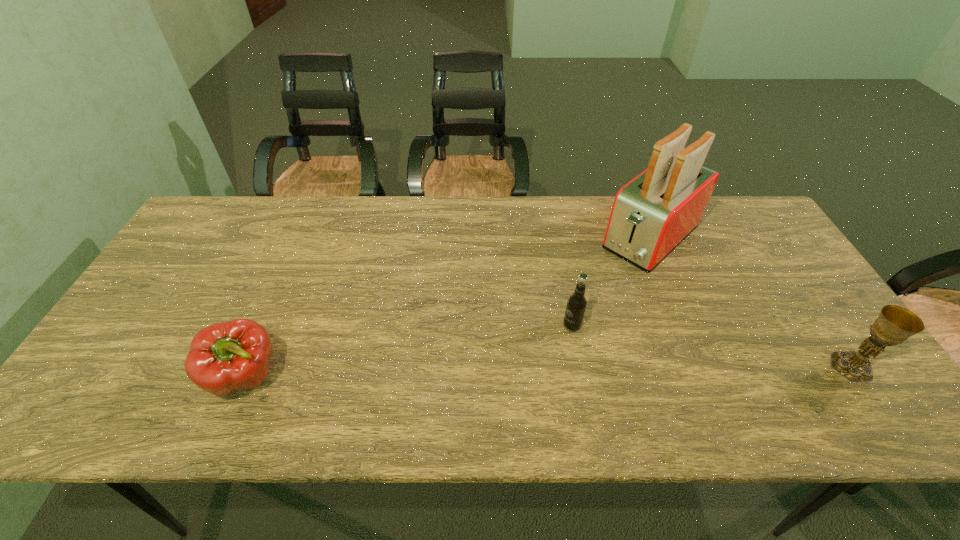
Identify the location of free point between the rightmost object and the third object from left to right. (751, 302).

In order to click on free area in between the toaster and the second object from left to right in this screenshot , I will do `click(612, 281)`.

I want to click on free space that is in between the root beer and the pepper, so click(x=409, y=352).

At what (x,y) coordinates should I click in order to perform the action: click on vacant space in between the chalice and the pepper. Please return your answer as a coordinate pair (x, y). This screenshot has width=960, height=540. Looking at the image, I should click on (549, 372).

Where is `object that stands as the third closest to the root beer`? Image resolution: width=960 pixels, height=540 pixels. object that stands as the third closest to the root beer is located at coordinates (225, 357).

Locate which object ranks in proximity to the third object from right to left. Please provide its 2D coordinates. Your answer should be formatted as a tuple, i.e. [(x, y)], where the tuple contains the x and y coordinates of a point satisfying the conditions above.

[(651, 215)]

Find the location of a particular element. free spot that satisfies the following two spatial constraints: 1. on the back side of the farthest object; 2. on the right side of the pepper is located at coordinates (305, 238).

Identify the location of vacant space that satisfies the following two spatial constraints: 1. on the front side of the rightmost object; 2. on the right side of the root beer. tap(579, 367).

The image size is (960, 540). Find the location of `vacant point that satisfies the following two spatial constraints: 1. on the back side of the third object from right to left; 2. on the left side of the pepper`. vacant point that satisfies the following two spatial constraints: 1. on the back side of the third object from right to left; 2. on the left side of the pepper is located at coordinates (269, 326).